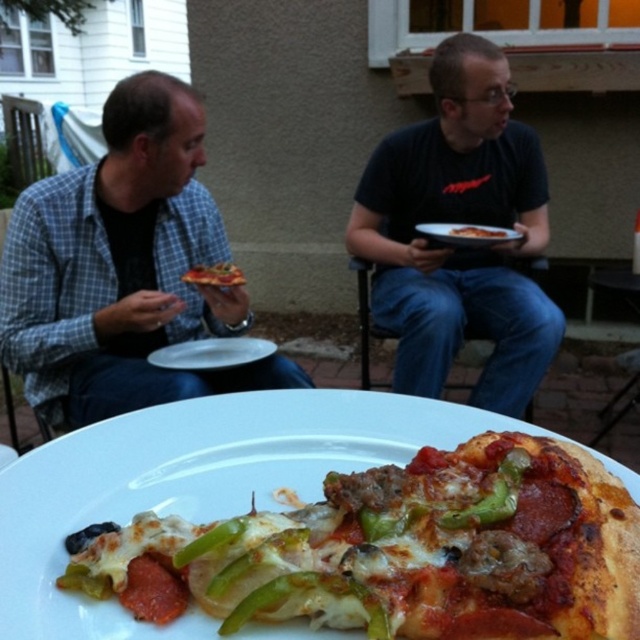
You are a food delivery person who needs to place a hot pizza box on the table. The pizza box is 30 cm wide. The table is between the pepperoni and green bell pepper pizza at center and the black matte shirt at upper center. Can the pizza box fit on the table without overlapping either object?

The distance between the pepperoni and green bell pepper pizza at center and the black matte shirt at upper center is 1.53 meters. Since the pizza box is only 30 cm wide, it can fit on the table between them as the space is more than sufficient.

You are a photographer trying to capture the cheesy pepperoni pizza at center and the white matte plate at center in a single shot. Since you want both objects to be clearly visible, which one should you focus on first to ensure the other remains in the frame?

The cheesy pepperoni pizza at center is behind the white matte plate at center, so you should focus on the white matte plate at center first to ensure the pizza behind it stays in the frame.